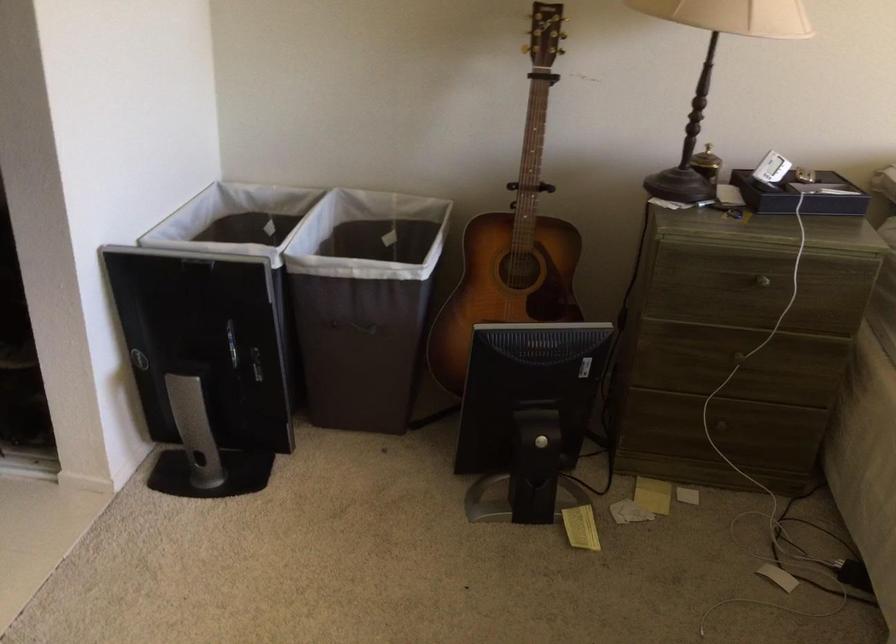
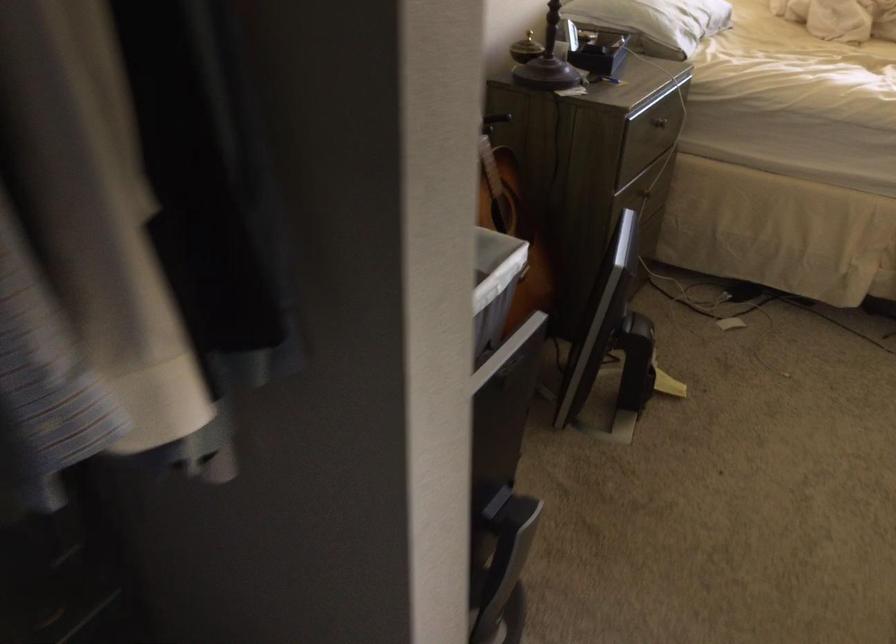
Locate, in the second image, the point that corresponds to point (731, 354) in the first image.

(645, 194)